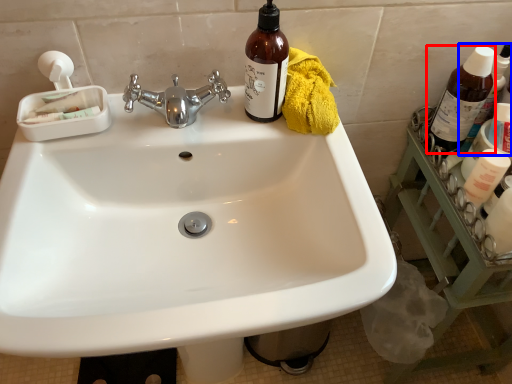
Question: Which object appears farthest to the camera in this image, bottle (highlighted by a red box) or bottle (highlighted by a blue box)?

Choices:
 (A) bottle
 (B) bottle

Answer: (B)